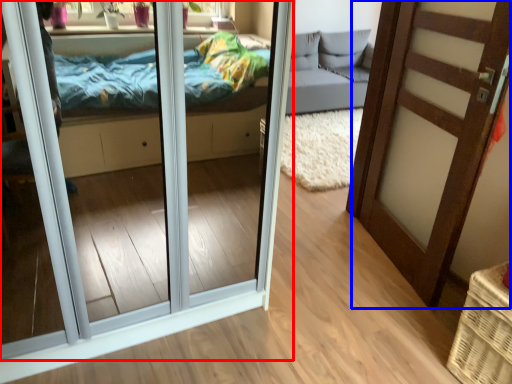
Question: Which of the following is the closest to the observer, door (highlighted by a red box) or door (highlighted by a blue box)?

Choices:
 (A) door
 (B) door

Answer: (A)